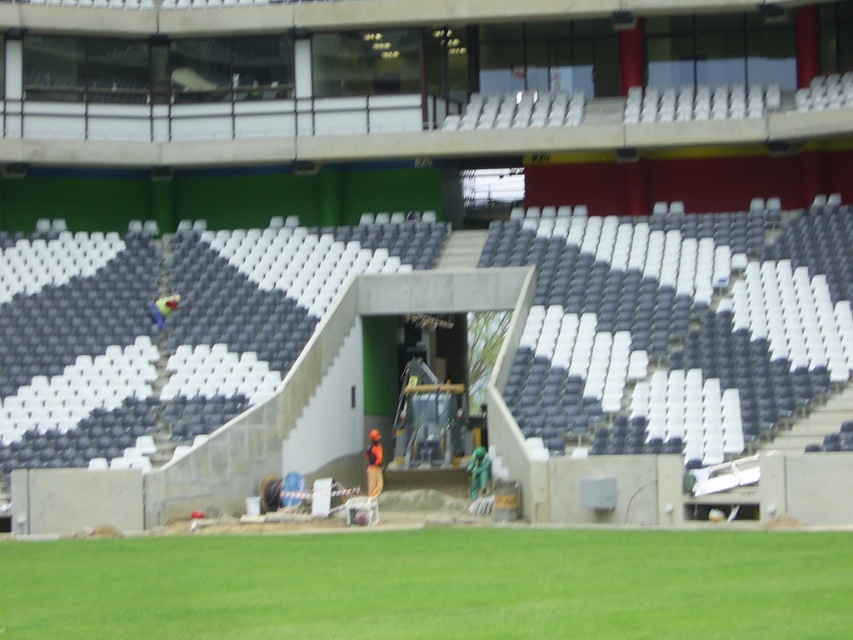
Question: Which point is closer to the camera?

Choices:
 (A) (593, 266)
 (B) (167, 545)

Answer: (B)

Question: Can you confirm if concrete stairs at center is positioned to the left of green grass at lower center?

Choices:
 (A) no
 (B) yes

Answer: (B)

Question: Which of the following is the farthest from the observer?

Choices:
 (A) (x=560, y=620)
 (B) (x=651, y=438)

Answer: (B)

Question: Is concrete stairs at center smaller than green grass at lower center?

Choices:
 (A) yes
 (B) no

Answer: (B)

Question: From the image, what is the correct spatial relationship of concrete stairs at center in relation to green grass at lower center?

Choices:
 (A) below
 (B) above

Answer: (B)